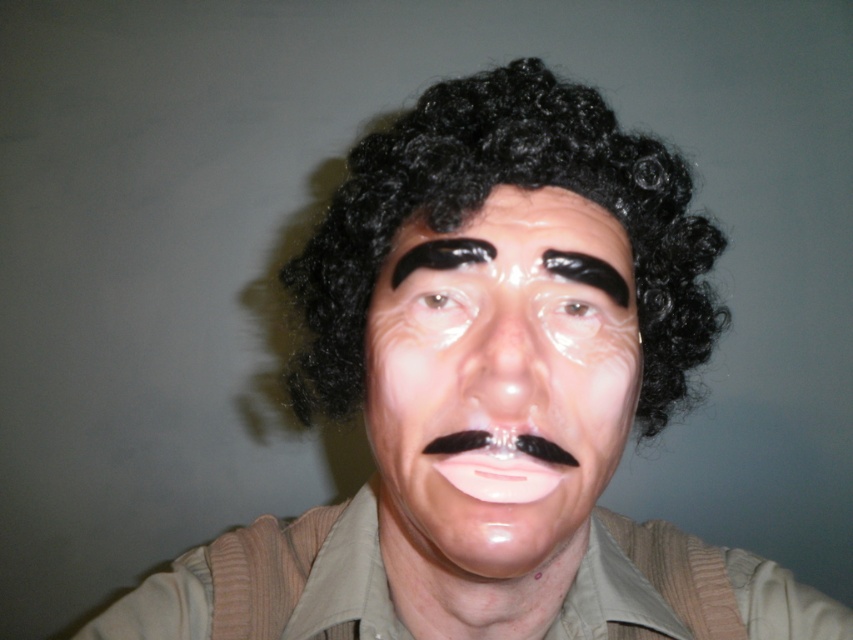
You are a makeup artist preparing for a costume party. You have a client who wants to apply the translucent plastic nose at center and the translucent plastic eye at center. Based on the image description, which of these two items should you place first to ensure proper alignment?

The translucent plastic eye at center should be placed first because the translucent plastic nose at center is positioned under it, so placing the eye first allows the nose to be placed below it correctly.

You are a makeup artist trying to apply a similar look to a client. You have two tools available, one for the glossy plastic face at center and another for the brown matte eye at center. Which tool should you use first to ensure proper application order?

The glossy plastic face at center is closer to the viewer than the brown matte eye at center, so you should apply the tool for the glossy plastic face at center first to ensure proper application order.